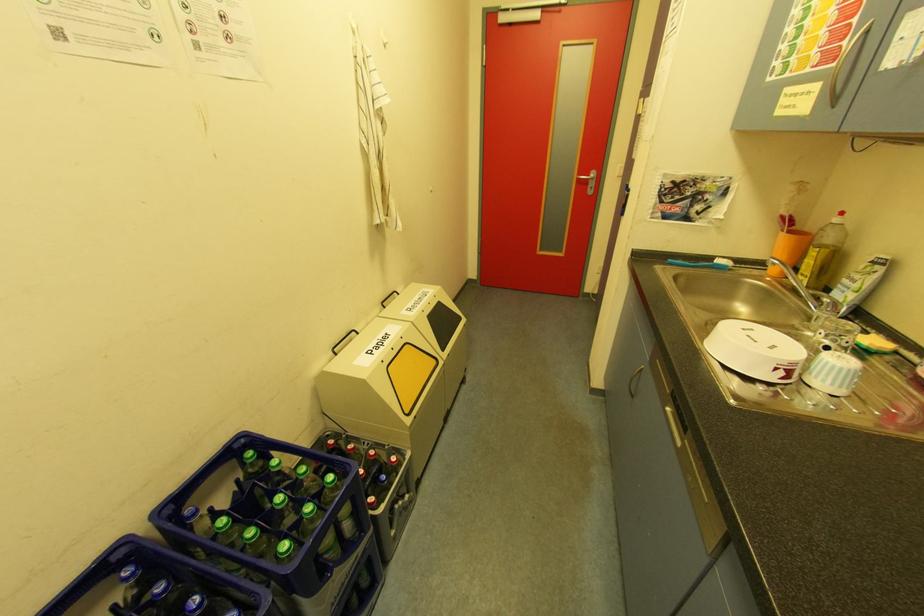
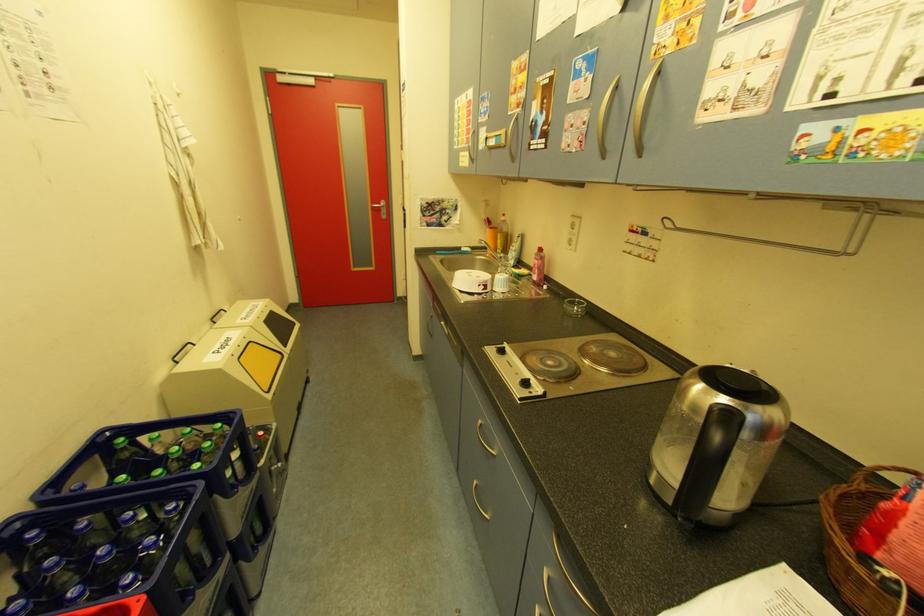
Question: The images are taken continuously from a first-person perspective. In which direction is your viewpoint rotating?

Choices:
 (A) Left
 (B) Right
 (C) Up
 (D) Down

Answer: (B)